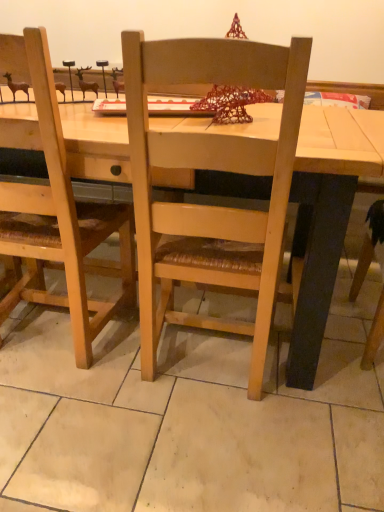
Question: Is point (349, 134) closer or farther from the camera than point (132, 86)?

Choices:
 (A) closer
 (B) farther

Answer: (B)

Question: Relative to natural wood chair at center, is light wood table at center in front or behind?

Choices:
 (A) behind
 (B) front

Answer: (A)

Question: Would you say light wood table at center is to the left or to the right of natural wood chair at center in the picture?

Choices:
 (A) left
 (B) right

Answer: (A)

Question: In the image, is natural wood chair at center positioned in front of or behind light wood table at center?

Choices:
 (A) front
 (B) behind

Answer: (A)

Question: Is natural wood chair at center taller or shorter than light wood table at center?

Choices:
 (A) tall
 (B) short

Answer: (A)

Question: From the image's perspective, is natural wood chair at center above or below light wood table at center?

Choices:
 (A) below
 (B) above

Answer: (A)

Question: Considering the positions of point (183, 279) and point (254, 131), is point (183, 279) closer or farther from the camera than point (254, 131)?

Choices:
 (A) closer
 (B) farther

Answer: (A)